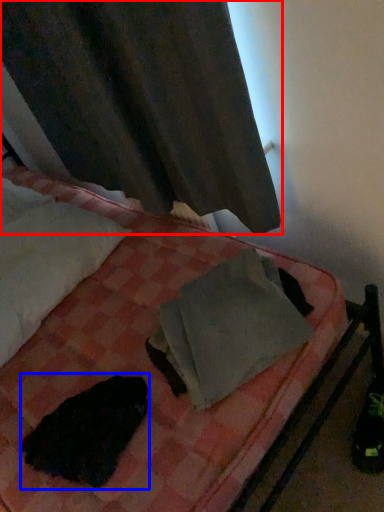
Question: Which object is further to the camera taking this photo, curtain (highlighted by a red box) or animal (highlighted by a blue box)?

Choices:
 (A) curtain
 (B) animal

Answer: (B)